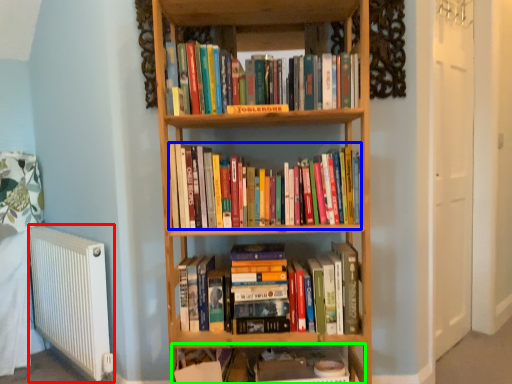
Question: Which is nearer to the radiator (highlighted by a red box)? book (highlighted by a blue box) or shelf (highlighted by a green box).

Choices:
 (A) book
 (B) shelf

Answer: (B)